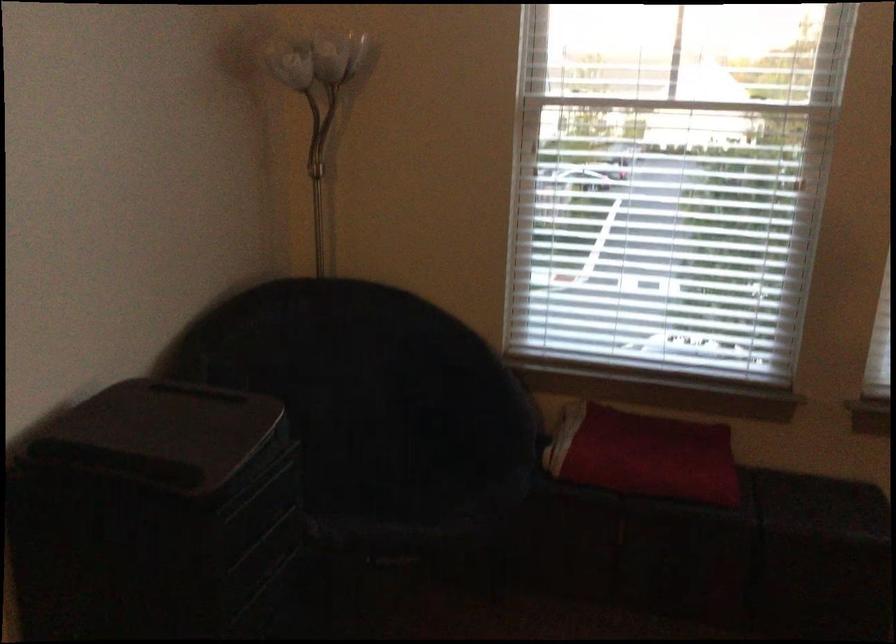
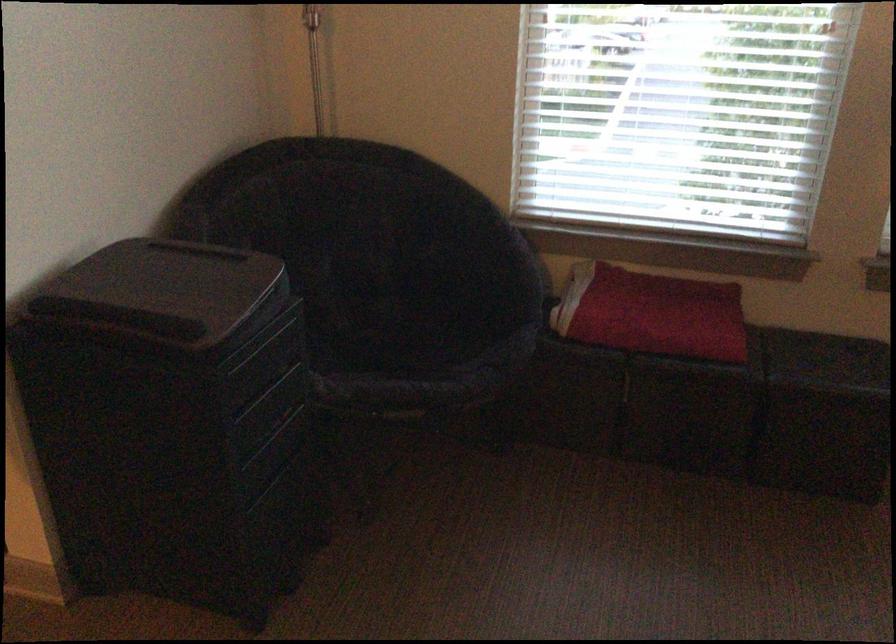
Locate, in the second image, the point that corresponds to (x=255, y=489) in the first image.

(260, 346)